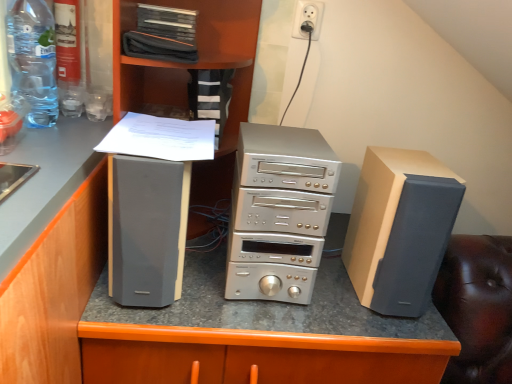
Question: From their relative heights in the image, would you say satin silver electronics at center is taller or shorter than transparent plastic bottle at upper left?

Choices:
 (A) short
 (B) tall

Answer: (B)

Question: Which is correct: satin silver electronics at center is inside transparent plastic bottle at upper left, or outside of it?

Choices:
 (A) inside
 (B) outside

Answer: (B)

Question: Which of these objects is positioned closest to the matte gray speaker at left?

Choices:
 (A) black fabric case at upper center
 (B) silver metallic stereo stack at center
 (C) matte black speaker at left
 (D) matte wood cabinet at left
 (E) satin silver electronics at center

Answer: (D)

Question: Estimate the real-world distances between objects in this image. Which object is closer to the matte gray speaker at left?

Choices:
 (A) matte black speaker at left
 (B) white plastic socket at upper center
 (C) black fabric case at upper center
 (D) white paper at center
 (E) matte wood cabinet at left

Answer: (E)